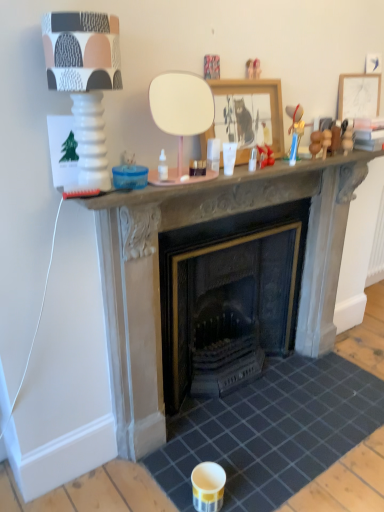
The height and width of the screenshot is (512, 384). I want to click on matte wooden picture frame at upper right, the 2th picture frame from the front, so click(x=359, y=95).

Find the location of a particular element. matte white lamp at upper left is located at coordinates pyautogui.click(x=84, y=79).

Is wooden framed picture at center, which appears as the 2th picture frame when viewed from the right, aimed at dark gray tile at center?

No, wooden framed picture at center, which appears as the 2th picture frame when viewed from the right, is not turned towards dark gray tile at center.

Considering the sizes of objects wooden framed picture at center, which appears as the first picture frame when viewed from the left, and dark gray tile at center in the image provided, who is wider, wooden framed picture at center, which appears as the first picture frame when viewed from the left, or dark gray tile at center?

With larger width is dark gray tile at center.

Considering the relative positions of wooden framed picture at center, which appears as the first picture frame when viewed from the front, and dark gray tile at center in the image provided, is wooden framed picture at center, which appears as the first picture frame when viewed from the front, to the left or to the right of dark gray tile at center?

Based on their positions, wooden framed picture at center, which appears as the first picture frame when viewed from the front, is located to the left of dark gray tile at center.

You are a GUI agent. You are given a task and a screenshot of the screen. Output one action in this format:
    pyautogui.click(x=<x>, y=<y>)
    Task: Click on the tile below the wooden framed picture at center, which ranks as the 2th picture frame in back-to-front order (from a real-world perspective)
    
    Given the screenshot: What is the action you would take?
    pyautogui.click(x=270, y=431)

Which is farther, (227, 164) or (129, 398)?

Point (129, 398)

Where is `coffee cup lying on the left of stone fireplace at center`? coffee cup lying on the left of stone fireplace at center is located at coordinates (229, 157).

Is white glossy coffee cup at upper center oriented away from stone fireplace at center?

white glossy coffee cup at upper center is not turned away from stone fireplace at center.

From a real-world perspective, does white glossy coffee cup at upper center sit lower than stone fireplace at center?

No, from a real-world perspective, white glossy coffee cup at upper center is not under stone fireplace at center.

Is matte wooden picture frame at upper right, the 2th picture frame from the front, positioned with its back to stone fireplace at center?

That's not correct — matte wooden picture frame at upper right, the 2th picture frame from the front, is not looking away from stone fireplace at center.

Is matte wooden picture frame at upper right, marked as the 1th picture frame in a right-to-left arrangement, spatially inside stone fireplace at center, or outside of it?

matte wooden picture frame at upper right, marked as the 1th picture frame in a right-to-left arrangement, cannot be found inside stone fireplace at center.

How many degrees apart are the facing directions of matte wooden picture frame at upper right, positioned as the second picture frame in left-to-right order, and stone fireplace at center?

0.422 degrees.

Where is `fireplace below the matte wooden picture frame at upper right, positioned as the second picture frame in left-to-right order (from a real-world perspective)`? fireplace below the matte wooden picture frame at upper right, positioned as the second picture frame in left-to-right order (from a real-world perspective) is located at coordinates click(x=158, y=272).

Who is bigger, stone fireplace at center or white glossy coffee cup at upper center?

stone fireplace at center.

Looking at this image, in terms of width, does stone fireplace at center look wider or thinner when compared to white glossy coffee cup at upper center?

In the image, stone fireplace at center appears to be wider than white glossy coffee cup at upper center.

I want to click on coffee cup behind the stone fireplace at center, so click(x=229, y=157).

This screenshot has width=384, height=512. In order to click on picture frame lying on the left of matte wooden picture frame at upper right, which appears as the first picture frame when viewed from the back in this screenshot , I will do `click(256, 95)`.

Is matte wooden picture frame at upper right, which appears as the first picture frame when viewed from the back, looking in the opposite direction of wooden framed picture at center, which appears as the first picture frame when viewed from the front?

No, matte wooden picture frame at upper right, which appears as the first picture frame when viewed from the back,'s orientation is not away from wooden framed picture at center, which appears as the first picture frame when viewed from the front.

Which is behind, point (374, 105) or point (275, 112)?

The point (374, 105) is farther.

From the picture: Would you consider matte white lamp at upper left to be distant from white glossy coffee cup at upper center?

That's not correct — matte white lamp at upper left is a little close to white glossy coffee cup at upper center.

Is matte white lamp at upper left inside the boundaries of white glossy coffee cup at upper center, or outside?

matte white lamp at upper left is located beyond the bounds of white glossy coffee cup at upper center.

Where is `coffee cup below the matte white lamp at upper left (from a real-world perspective)`? coffee cup below the matte white lamp at upper left (from a real-world perspective) is located at coordinates (229, 157).

Is matte white lamp at upper left shorter than white glossy coffee cup at upper center?

Incorrect, the height of matte white lamp at upper left does not fall short of that of white glossy coffee cup at upper center.

Is wooden framed picture at center, which appears as the 2th picture frame when viewed from the right, taller than white glossy coffee cup at upper center?

Correct, wooden framed picture at center, which appears as the 2th picture frame when viewed from the right, is much taller as white glossy coffee cup at upper center.

Does wooden framed picture at center, which ranks as the 2th picture frame in back-to-front order, touch white glossy coffee cup at upper center?

No, wooden framed picture at center, which ranks as the 2th picture frame in back-to-front order, is not in contact with white glossy coffee cup at upper center.

Is wooden framed picture at center, which ranks as the 2th picture frame in back-to-front order, behind white glossy coffee cup at upper center?

Yes, the depth of wooden framed picture at center, which ranks as the 2th picture frame in back-to-front order, is greater than that of white glossy coffee cup at upper center.

In the scene shown: Would you say wooden framed picture at center, which appears as the first picture frame when viewed from the front, contains white glossy coffee cup at upper center?

No.

The width and height of the screenshot is (384, 512). Identify the location of tile below the wooden framed picture at center, which appears as the first picture frame when viewed from the front (from a real-world perspective). (270, 431).

The width and height of the screenshot is (384, 512). I want to click on coffee cup located on the left of stone fireplace at center, so click(x=229, y=157).

Which object lies nearer to the anchor point stone fireplace at center, matte wooden picture frame at upper right, the 2th picture frame from the front, or white glossy coffee cup at upper center?

The object closer to stone fireplace at center is white glossy coffee cup at upper center.

From the image, which object appears to be farther from white glossy coffee cup at upper center, stone fireplace at center or wooden framed picture at center, which appears as the first picture frame when viewed from the front?

stone fireplace at center lies further to white glossy coffee cup at upper center than the other object.

Which object lies further to the anchor point wooden framed picture at center, which appears as the 2th picture frame when viewed from the right, stone fireplace at center or white glossy coffee cup at upper center?

Based on the image, stone fireplace at center appears to be further to wooden framed picture at center, which appears as the 2th picture frame when viewed from the right.

Looking at this image, from the image, which object appears to be nearer to matte wooden picture frame at upper right, positioned as the second picture frame in left-to-right order, dark gray tile at center or matte white lamp at upper left?

matte white lamp at upper left is closer to matte wooden picture frame at upper right, positioned as the second picture frame in left-to-right order.

From the image, which object appears to be nearer to matte white lamp at upper left, wooden framed picture at center, which appears as the 2th picture frame when viewed from the right, or white glossy coffee cup at upper center?

The object closer to matte white lamp at upper left is wooden framed picture at center, which appears as the 2th picture frame when viewed from the right.

Estimate the real-world distances between objects in this image. Which object is further from white glossy coffee cup at upper center, matte wooden picture frame at upper right, marked as the 1th picture frame in a right-to-left arrangement, or matte white lamp at upper left?

Among the two, matte wooden picture frame at upper right, marked as the 1th picture frame in a right-to-left arrangement, is located further to white glossy coffee cup at upper center.

From the image, which object appears to be nearer to wooden framed picture at center, which appears as the first picture frame when viewed from the left, white glossy coffee cup at upper center or matte wooden picture frame at upper right, which appears as the first picture frame when viewed from the back?

The object closer to wooden framed picture at center, which appears as the first picture frame when viewed from the left, is white glossy coffee cup at upper center.

Considering their positions, is matte white lamp at upper left positioned closer to white glossy coffee cup at upper center than dark gray tile at center?

Based on the image, matte white lamp at upper left appears to be nearer to white glossy coffee cup at upper center.

The width and height of the screenshot is (384, 512). In order to click on fireplace between wooden framed picture at center, which appears as the 2th picture frame when viewed from the right, and dark gray tile at center in the up-down direction in this screenshot , I will do `click(158, 272)`.

At what (x,y) coordinates should I click in order to perform the action: click on fireplace between matte wooden picture frame at upper right, the 2th picture frame from the front, and dark gray tile at center, in the vertical direction. Please return your answer as a coordinate pair (x, y). Image resolution: width=384 pixels, height=512 pixels. Looking at the image, I should click on (158, 272).

Where is `fireplace between white glossy coffee cup at upper center and dark gray tile at center in the up-down direction`? The height and width of the screenshot is (512, 384). fireplace between white glossy coffee cup at upper center and dark gray tile at center in the up-down direction is located at coordinates (158, 272).

The height and width of the screenshot is (512, 384). In order to click on coffee cup between matte white lamp at upper left and wooden framed picture at center, which appears as the first picture frame when viewed from the left, from left to right in this screenshot , I will do pyautogui.click(x=229, y=157).